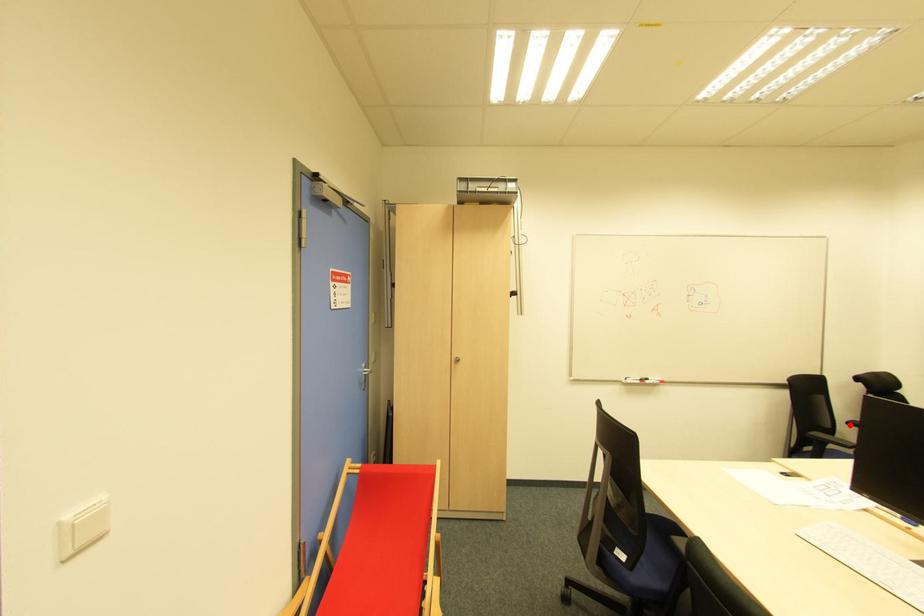
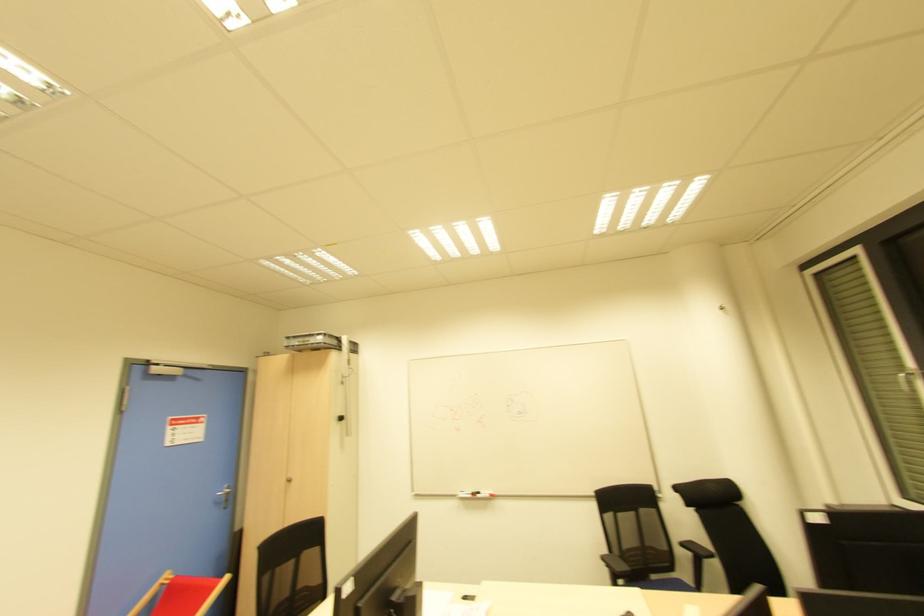
Where in the second image is the point corresponding to the highlighted location from the first image?

(681, 545)